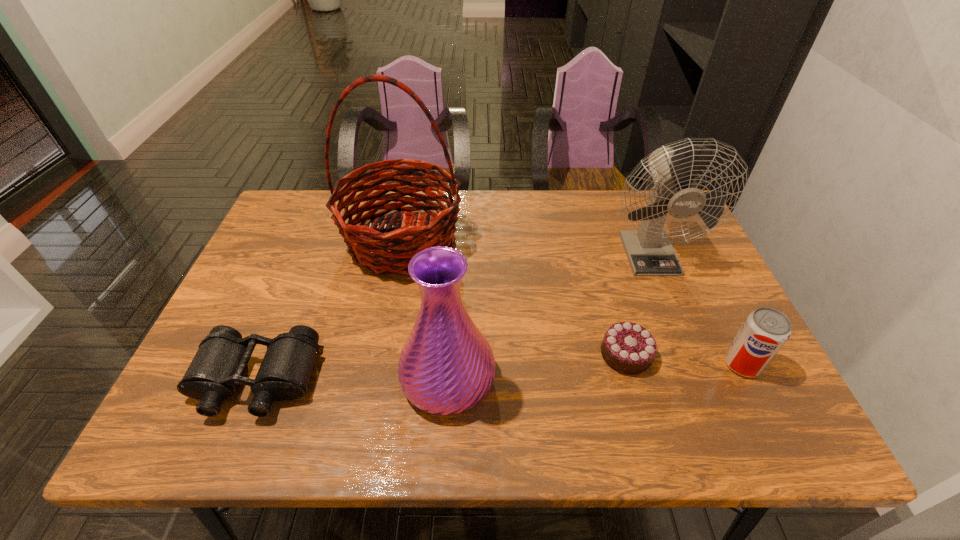
I want to click on vacant space situated 0.220m on the left of the chocolate cake, so click(502, 355).

Locate an element on the screen. The width and height of the screenshot is (960, 540). basket present at the far edge is located at coordinates (369, 245).

Identify the location of fan present at the far edge. (649, 251).

Image resolution: width=960 pixels, height=540 pixels. What are the coordinates of `vase positioned at the near edge` in the screenshot? It's located at (446, 367).

Identify the location of binoculars that is at the near edge. The width and height of the screenshot is (960, 540). (218, 366).

Where is `object that is at the left edge`? This screenshot has height=540, width=960. object that is at the left edge is located at coordinates (218, 366).

Locate an element on the screen. fan at the right edge is located at coordinates (649, 251).

Where is `soda present at the right edge`? The width and height of the screenshot is (960, 540). soda present at the right edge is located at coordinates (764, 332).

At what (x,y) coordinates should I click in order to perform the action: click on object that is positioned at the near left corner. Please return your answer as a coordinate pair (x, y). This screenshot has width=960, height=540. Looking at the image, I should click on (218, 366).

At what (x,y) coordinates should I click in order to perform the action: click on object that is at the far right corner. Please return your answer as a coordinate pair (x, y). This screenshot has height=540, width=960. Looking at the image, I should click on (649, 251).